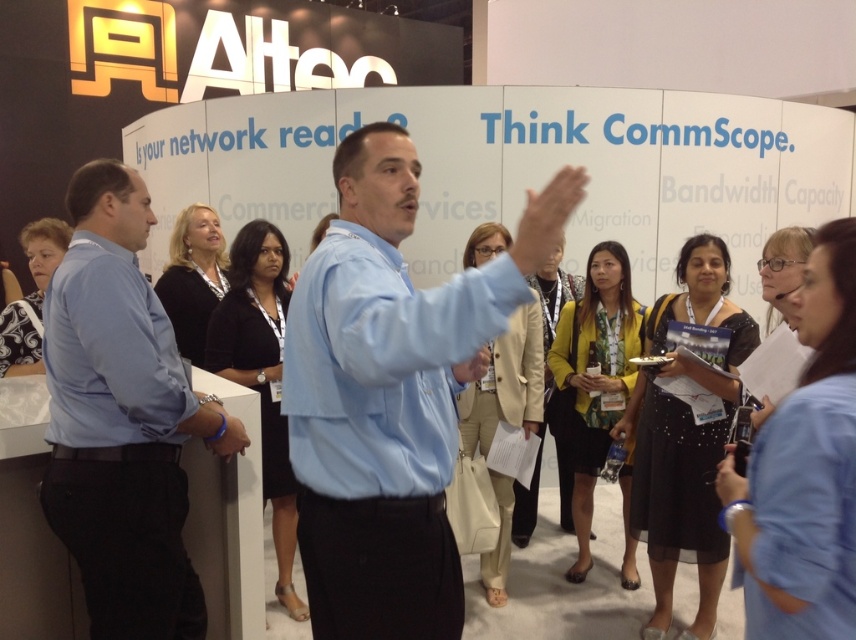
Consider the image. Can you confirm if light blue shirt at center is positioned to the right of blue shirt at left?

Yes, light blue shirt at center is to the right of blue shirt at left.

Is light blue shirt at center shorter than blue shirt at left?

Yes.

Does point (361, 500) lie in front of point (55, 284)?

Yes, point (361, 500) is closer to viewer.

Where is `light blue shirt at center`? The image size is (856, 640). light blue shirt at center is located at coordinates (391, 394).